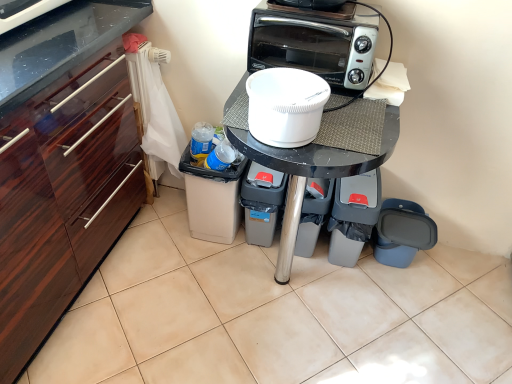
You are a GUI agent. You are given a task and a screenshot of the screen. Output one action in this format:
    pyautogui.click(x=<x>, y=<y>)
    Task: Click on the free location in front of black glossy table at center
    Image resolution: width=512 pixels, height=384 pixels.
    Given the screenshot: What is the action you would take?
    pyautogui.click(x=279, y=356)